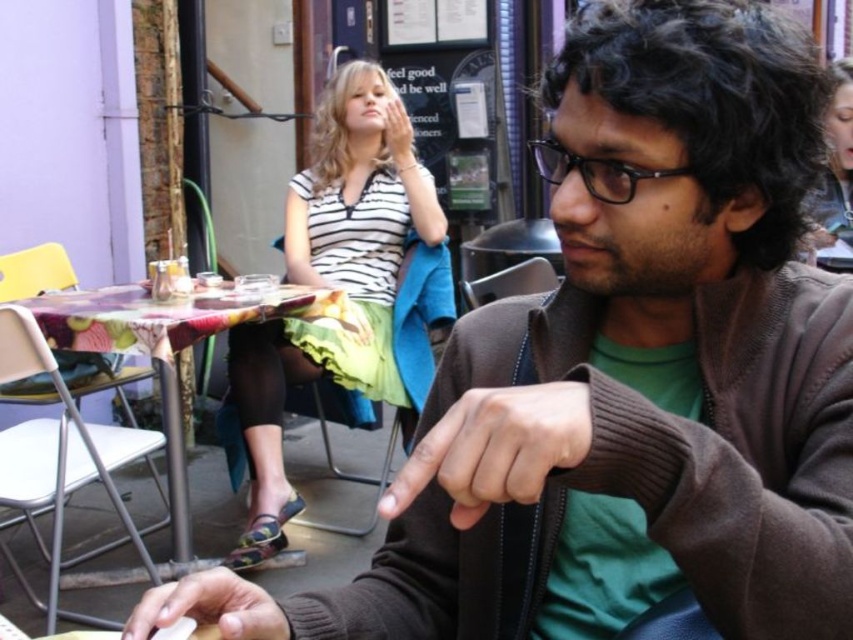
You are a photographer trying to capture a candid shot of the white striped shirt at upper center and the printed fabric table at center. Your camera has a maximum focus range of 16 inches. Will you be able to focus on both subjects simultaneously?

The white striped shirt at upper center and printed fabric table at center are 15.83 inches apart, so yes, the camera can focus on both subjects since the distance between them is within the 16 inches maximum focus range.

You are a photographer trying to capture the scene from the front. Since the white striped shirt at upper center and the printed fabric table at center are both in your view, which one will appear larger in your photo?

The white striped shirt at upper center is bigger than the printed fabric table at center, so it will appear larger in the photo.